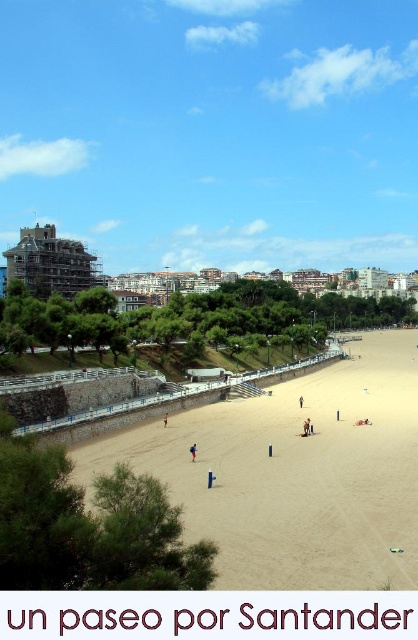
Question: Is light brown sand at center bigger than bright blue fabric at center?

Choices:
 (A) yes
 (B) no

Answer: (A)

Question: Does light brown sand at center appear on the left side of brown sand at center?

Choices:
 (A) yes
 (B) no

Answer: (B)

Question: Can you confirm if tan skin person at center is positioned to the right of bright blue fabric at center?

Choices:
 (A) no
 (B) yes

Answer: (B)

Question: Which object is closer to the camera taking this photo?

Choices:
 (A) bright blue fabric at center
 (B) brown sand at center
 (C) light brown sand at center
 (D) tan skin person at center

Answer: (C)

Question: Which object is positioned closest to the brown sand at center?

Choices:
 (A) brown fabric person at center
 (B) light brown sand at center
 (C) bright blue fabric at center
 (D) tan skin person at center

Answer: (C)

Question: Which point is closer to the camera taking this photo?

Choices:
 (A) (195, 448)
 (B) (167, 417)

Answer: (A)